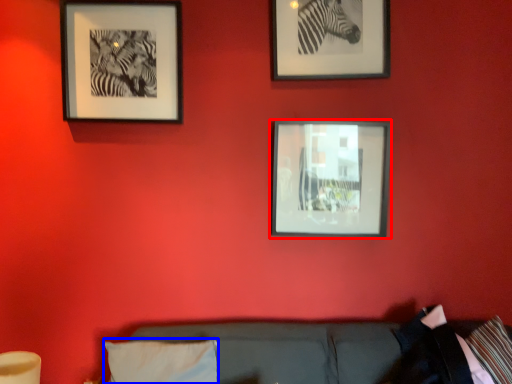
Question: Which object appears farthest to the camera in this image, picture frame (highlighted by a red box) or pillow (highlighted by a blue box)?

Choices:
 (A) picture frame
 (B) pillow

Answer: (A)